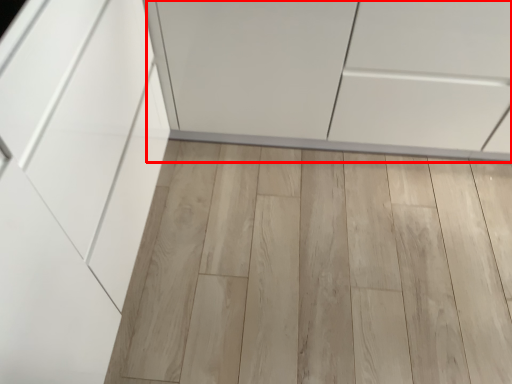
Question: From the image, what is the correct spatial relationship of cabinetry (annotated by the red box) in relation to plank?

Choices:
 (A) right
 (B) left

Answer: (A)